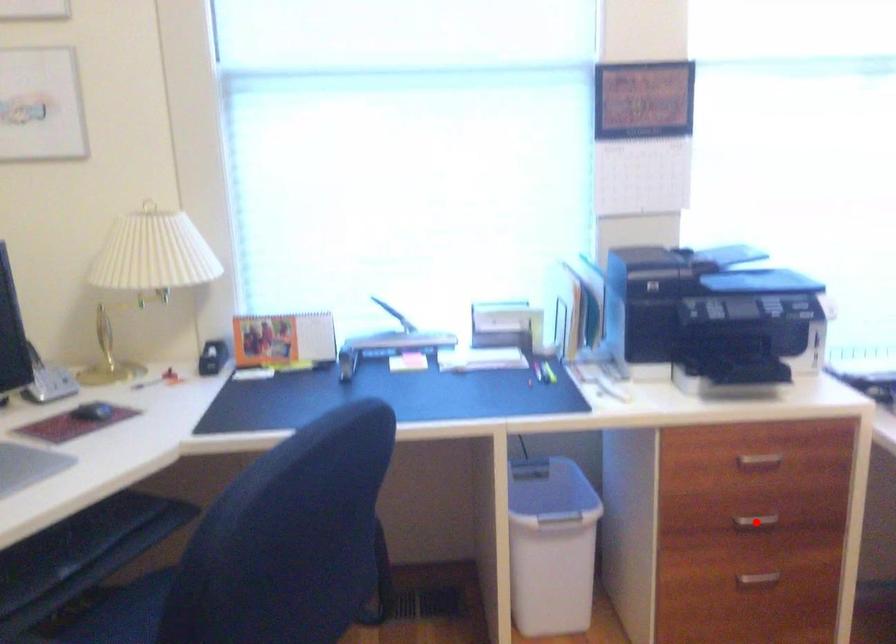
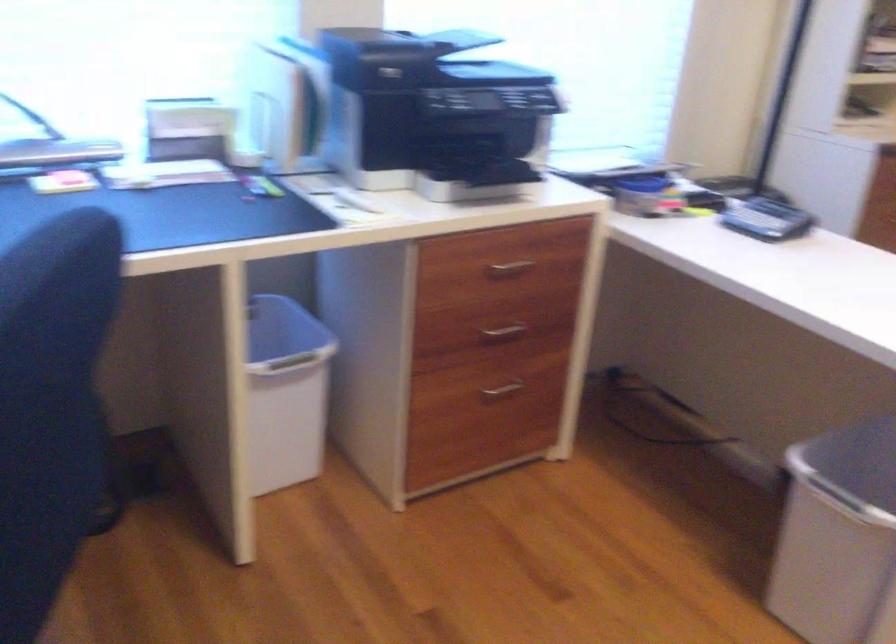
In the second image, find the point that corresponds to the highlighted location in the first image.

(503, 330)